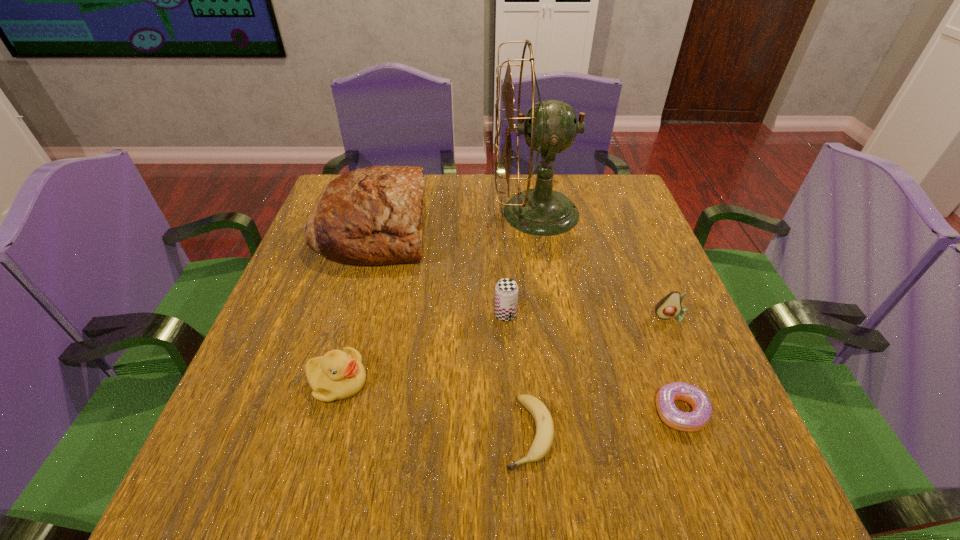
Find the location of `free space located at the sliced front of the bread`. free space located at the sliced front of the bread is located at coordinates (573, 228).

This screenshot has width=960, height=540. In order to click on vacant space located 0.110m on the back of the beer can in this screenshot , I will do `click(503, 273)`.

Where is `free space located on the seed side of the avocado`? The height and width of the screenshot is (540, 960). free space located on the seed side of the avocado is located at coordinates (732, 462).

You are a GUI agent. You are given a task and a screenshot of the screen. Output one action in this format:
    pyautogui.click(x=<x>, y=<y>)
    Task: Click on the vacant space located at the face of the duckling
    The image size is (960, 540).
    Given the screenshot: What is the action you would take?
    pyautogui.click(x=416, y=382)

At what (x,y) coordinates should I click in order to perform the action: click on free space located 0.260m on the back of the doughnut. Please return your answer as a coordinate pair (x, y). The height and width of the screenshot is (540, 960). Looking at the image, I should click on (636, 291).

Where is `vacant area located 0.250m on the back of the shortest object`? The image size is (960, 540). vacant area located 0.250m on the back of the shortest object is located at coordinates (517, 299).

Identify the location of fan located at the far edge. (550, 127).

In order to click on bread situated at the far edge in this screenshot , I will do `click(370, 216)`.

Identify the location of object that is positioned at the near edge. Image resolution: width=960 pixels, height=540 pixels. (544, 435).

This screenshot has height=540, width=960. Find the location of `bread that is at the left edge`. bread that is at the left edge is located at coordinates (370, 216).